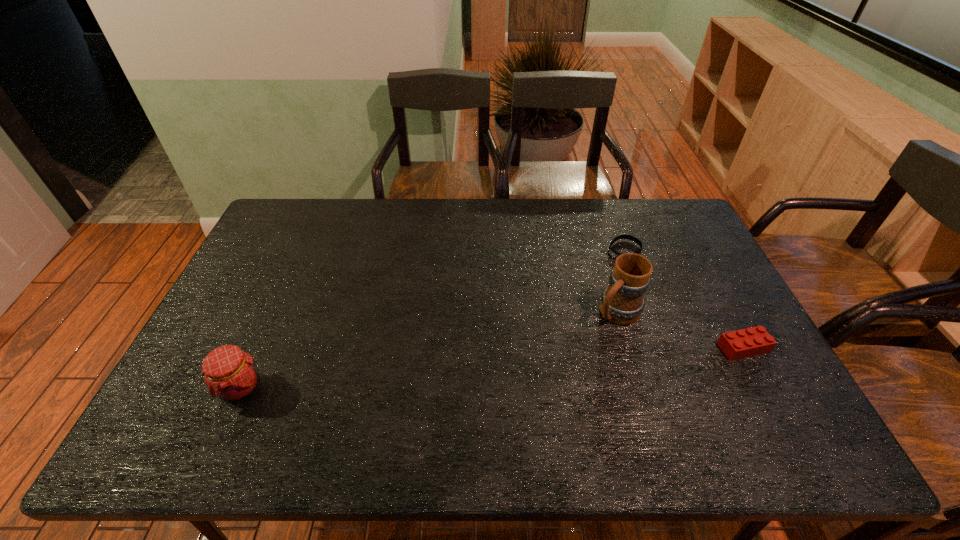
This screenshot has width=960, height=540. Identify the location of free space located 0.270m on the display of the shortest object. (561, 299).

Identify the location of free spot located 0.390m on the display of the shortest object. The image size is (960, 540). (533, 320).

The image size is (960, 540). What are the coordinates of `free point located on the display of the shortest object` in the screenshot? It's located at (599, 269).

Identify the location of vacant point located on the side of the mug with the handle. (542, 382).

What are the coordinates of `vacant region located on the side of the mug with the handle` in the screenshot? It's located at (581, 346).

This screenshot has width=960, height=540. In order to click on vacant region located 0.260m on the side of the mug with the handle in this screenshot , I will do `click(542, 382)`.

The height and width of the screenshot is (540, 960). What are the coordinates of `object at the near edge` in the screenshot? It's located at (230, 374).

At what (x,y) coordinates should I click in order to perform the action: click on object located in the left edge section of the desktop. Please return your answer as a coordinate pair (x, y). This screenshot has width=960, height=540. Looking at the image, I should click on (230, 374).

Image resolution: width=960 pixels, height=540 pixels. What are the coordinates of `object that is at the right edge` in the screenshot? It's located at (753, 341).

You are a GUI agent. You are given a task and a screenshot of the screen. Output one action in this format:
    pyautogui.click(x=<x>, y=<y>)
    Task: Click on the object that is at the near left corner
    The width and height of the screenshot is (960, 540).
    Given the screenshot: What is the action you would take?
    pyautogui.click(x=230, y=374)